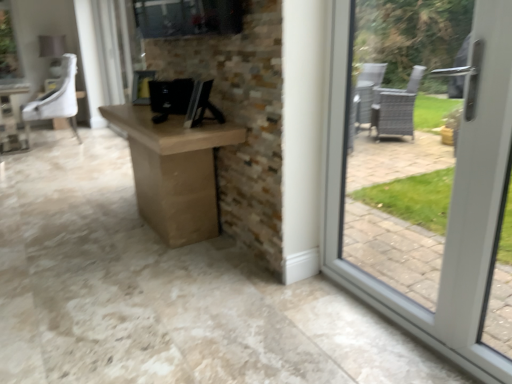
The height and width of the screenshot is (384, 512). Describe the element at coordinates (170, 97) in the screenshot. I see `black glossy desktop computer at center` at that location.

The width and height of the screenshot is (512, 384). What do you see at coordinates (128, 285) in the screenshot?
I see `brown cardboard box at center` at bounding box center [128, 285].

Locate an element on the screen. black glossy desktop computer at center is located at coordinates (170, 97).

Which of these two, brown cardboard box at center or white leather chair at upper left, stands shorter?

With less height is brown cardboard box at center.

Could you tell me if brown cardboard box at center is turned towards white leather chair at upper left?

No, brown cardboard box at center is not turned towards white leather chair at upper left.

Are brown cardboard box at center and white leather chair at upper left beside each other?

No, brown cardboard box at center is not touching white leather chair at upper left.

Is white leather chair at upper left located outside black glossy desktop computer at center?

Indeed, white leather chair at upper left is completely outside black glossy desktop computer at center.

Is white leather chair at upper left shorter than black glossy desktop computer at center?

No.

In terms of width, does white leather chair at upper left look wider or thinner when compared to black glossy desktop computer at center?

Considering their sizes, white leather chair at upper left looks broader than black glossy desktop computer at center.

Is white leather chair at upper left turned away from black glossy desktop computer at center?

No, white leather chair at upper left is not facing the opposite direction of black glossy desktop computer at center.

Is point (159, 92) positioned before point (74, 66)?

Yes.

From the image's perspective, relative to white leather chair at upper left, is black glossy desktop computer at center above or below?

Based on their image positions, black glossy desktop computer at center is located beneath white leather chair at upper left.

What are the coordinates of `chair above the black glossy desktop computer at center (from the image's perspective)` in the screenshot? It's located at (56, 100).

Between black glossy desktop computer at center and white leather chair at upper left, which one has larger width?

With larger width is white leather chair at upper left.

From the image's perspective, which is below, black glossy desktop computer at center or brown cardboard box at center?

brown cardboard box at center appears lower in the image.

Do you think black glossy desktop computer at center is within brown cardboard box at center, or outside of it?

black glossy desktop computer at center is located beyond the bounds of brown cardboard box at center.

Does black glossy desktop computer at center have a larger size compared to brown cardboard box at center?

Actually, black glossy desktop computer at center might be smaller than brown cardboard box at center.

From a real-world perspective, who is located higher, black glossy desktop computer at center or brown cardboard box at center?

black glossy desktop computer at center.

Who is smaller, white leather chair at upper left or brown cardboard box at center?

white leather chair at upper left is smaller.

Is white leather chair at upper left taller than brown cardboard box at center?

Yes, white leather chair at upper left is taller than brown cardboard box at center.

Locate an element on the screen. concrete located underneath the white leather chair at upper left (from a real-world perspective) is located at coordinates (128, 285).

Are white leather chair at upper left and brown cardboard box at center making contact?

They are not placed beside each other.

Considering the sizes of objects brown cardboard box at center and black glossy desktop computer at center in the image provided, who is thinner, brown cardboard box at center or black glossy desktop computer at center?

Thinner between the two is black glossy desktop computer at center.

Choose the correct answer: Is brown cardboard box at center inside black glossy desktop computer at center or outside it?

brown cardboard box at center cannot be found inside black glossy desktop computer at center.

You are a GUI agent. You are given a task and a screenshot of the screen. Output one action in this format:
    pyautogui.click(x=<x>, y=<y>)
    Task: Click on the concrete below the black glossy desktop computer at center (from a real-world perspective)
    
    Given the screenshot: What is the action you would take?
    pyautogui.click(x=128, y=285)

Identify the location of concrete located in front of the white leather chair at upper left. The width and height of the screenshot is (512, 384). (128, 285).

The width and height of the screenshot is (512, 384). Identify the location of chair that appears on the left of black glossy desktop computer at center. (56, 100).

From the image, which object appears to be nearer to brown cardboard box at center, black glossy desktop computer at center or white leather chair at upper left?

Among the two, black glossy desktop computer at center is located nearer to brown cardboard box at center.

Estimate the real-world distances between objects in this image. Which object is closer to white leather chair at upper left, black glossy desktop computer at center or brown cardboard box at center?

brown cardboard box at center.

Based on their spatial positions, is brown cardboard box at center or black glossy desktop computer at center further from white leather chair at upper left?

black glossy desktop computer at center lies further to white leather chair at upper left than the other object.

Looking at the image, which one is located further to black glossy desktop computer at center, white leather chair at upper left or brown cardboard box at center?

Among the two, white leather chair at upper left is located further to black glossy desktop computer at center.

Based on their spatial positions, is brown cardboard box at center or white leather chair at upper left further from black glossy desktop computer at center?

white leather chair at upper left is further to black glossy desktop computer at center.

Consider the image. Based on their spatial positions, is white leather chair at upper left or black glossy desktop computer at center further from brown cardboard box at center?

white leather chair at upper left.

I want to click on desktop computer positioned between brown cardboard box at center and white leather chair at upper left from near to far, so (x=170, y=97).